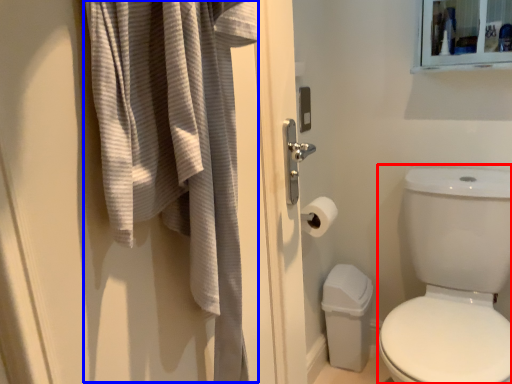
Question: Among these objects, which one is farthest to the camera, toilet bowl (highlighted by a red box) or bath towel (highlighted by a blue box)?

Choices:
 (A) toilet bowl
 (B) bath towel

Answer: (A)